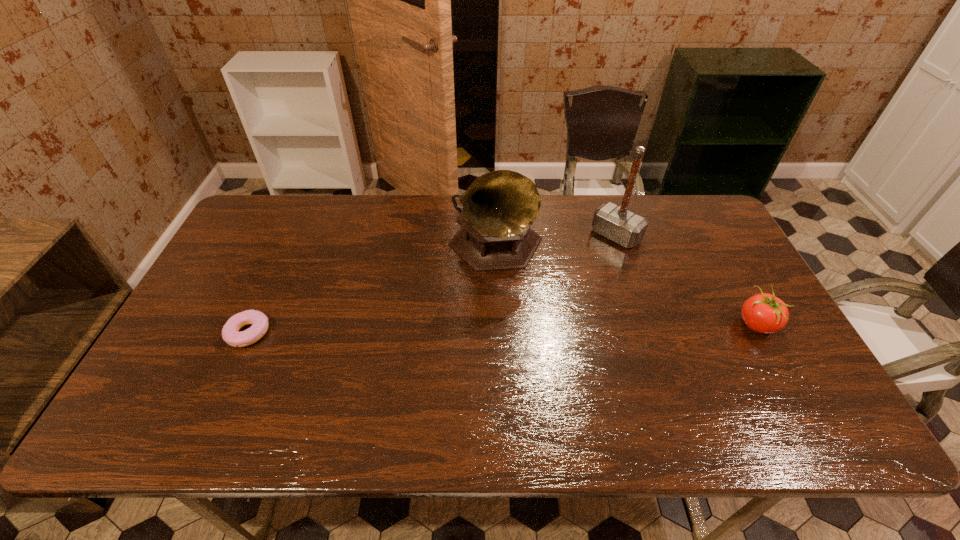
Image resolution: width=960 pixels, height=540 pixels. Identify the location of the shortest object. point(259,321).

Where is `doughnut`? This screenshot has height=540, width=960. doughnut is located at coordinates (259, 321).

At what (x,y) coordinates should I click in order to perform the action: click on the rightmost object. Please return your answer as a coordinate pair (x, y). Looking at the image, I should click on (764, 313).

Locate an element on the screen. The width and height of the screenshot is (960, 540). the second shortest object is located at coordinates (764, 313).

Where is `the second object from left to right`? the second object from left to right is located at coordinates (499, 207).

The image size is (960, 540). In order to click on the third object from left to right in this screenshot , I will do pyautogui.click(x=612, y=221).

You are a GUI agent. You are given a task and a screenshot of the screen. Output one action in this format:
    pyautogui.click(x=<x>, y=<y>)
    Task: Click on the free location located 0.230m on the back of the shortest object
    This screenshot has height=540, width=960.
    Given the screenshot: What is the action you would take?
    pyautogui.click(x=282, y=258)

I want to click on vacant region located 0.070m on the front of the rightmost object, so (779, 366).

Where is `free point located on the horn direction of the third object from right to left`? The image size is (960, 540). free point located on the horn direction of the third object from right to left is located at coordinates (567, 322).

I want to click on vacant space located 0.190m on the horn direction of the third object from right to left, so click(573, 327).